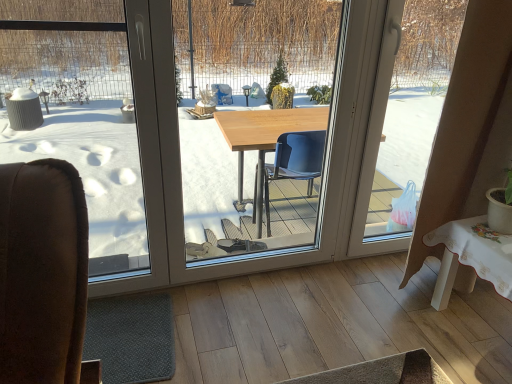
You are a GUI agent. You are given a task and a screenshot of the screen. Output one action in this format:
    pyautogui.click(x=<x>, y=<y>)
    Task: Click on the vacant space that's between gray rubber mat at lower left and transparent plastic bag at right, which is the first window screen in right-to-left order
    This screenshot has height=384, width=512.
    Given the screenshot: What is the action you would take?
    pyautogui.click(x=275, y=290)